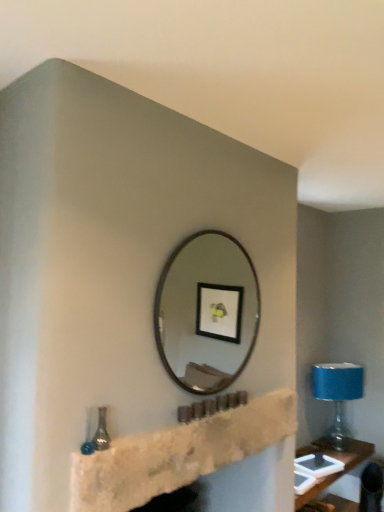
What are the coordinates of `free space above metallic silver mirror at center (from a real-world perspective)` in the screenshot? It's located at (216, 228).